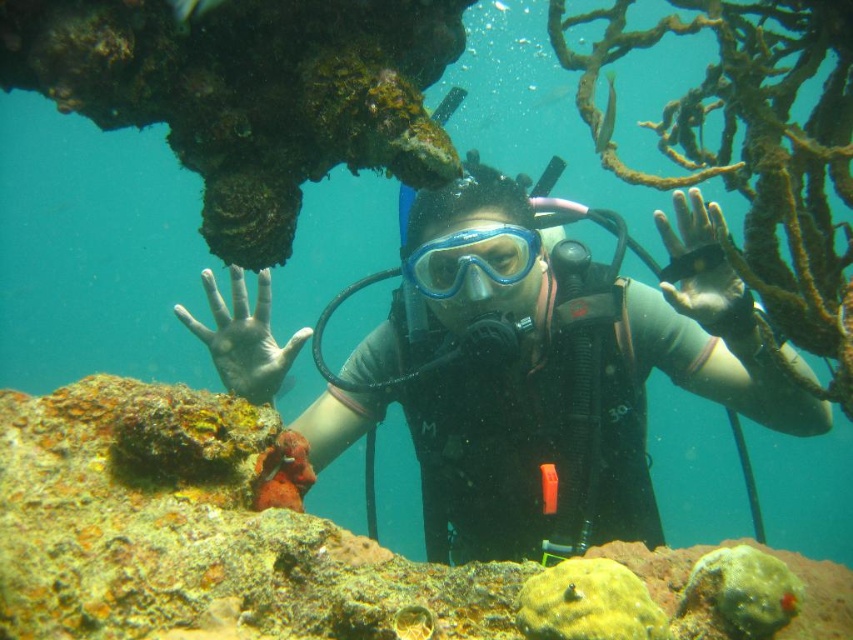
You are a marine biologist analyzing an underwater image. The image shows a matte black scuba diver at center. Based on the coordinates provided, can you determine if the diver is positioned closer to the top or bottom of the image?

The matte black scuba diver at center is located at point (x=550, y=380). Since the y coordinate is 0.647, which is closer to 1.0, the diver is positioned closer to the bottom of the image.

You are an underwater photographer positioned at the point marked by the coordinates point [550,380]. You need to capture a photo of the matte black scuba diver at center. Based on your current position, will you be able to see the entire diver in your camera frame?

The point [550,380] marks the matte black scuba diver at center, so you are positioned directly at the diver. Therefore, you cannot see the entire diver in your camera frame as you are at the same location.

You are a marine biologist observing the underwater scene. You notice the matte black scuba diver at center and the matte rubber hand at center. Which object is positioned closer to your viewpoint?

The matte black scuba diver at center is closer to the viewer than the matte rubber hand at center.